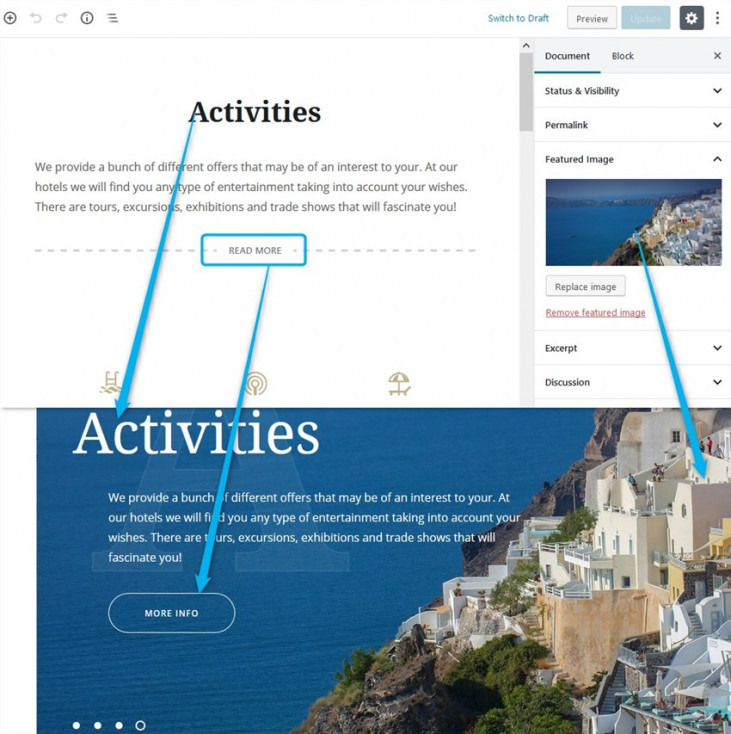
Locate an element on the screen. The height and width of the screenshot is (734, 731). stairs is located at coordinates (610, 697), (696, 622), (560, 671), (537, 630), (529, 616).